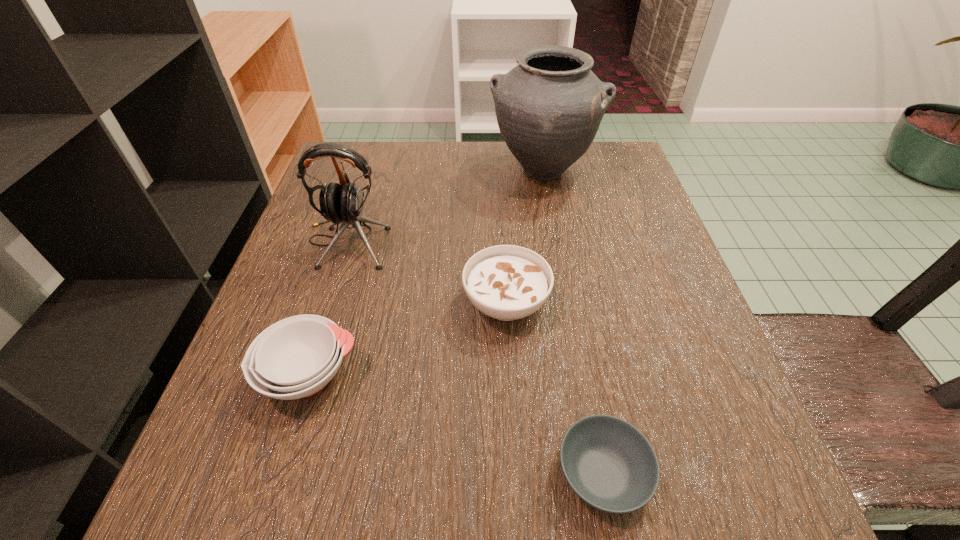
Identify the location of object situated at the far edge. The width and height of the screenshot is (960, 540). (549, 107).

You are a GUI agent. You are given a task and a screenshot of the screen. Output one action in this format:
    pyautogui.click(x=<x>, y=<y>)
    Task: Click on the object that is positioned at the near edge
    This screenshot has width=960, height=540.
    Given the screenshot: What is the action you would take?
    [609, 464]

The height and width of the screenshot is (540, 960). I want to click on earphone positioned at the left edge, so click(343, 203).

Locate an element on the screen. The width and height of the screenshot is (960, 540). soup bowl that is at the left edge is located at coordinates (296, 357).

At what (x,y) coordinates should I click in order to perform the action: click on urn at the right edge. Please return your answer as a coordinate pair (x, y). The height and width of the screenshot is (540, 960). Looking at the image, I should click on (549, 107).

Identify the location of soup bowl that is at the right edge. The image size is (960, 540). (609, 464).

Where is `object at the far right corner`? object at the far right corner is located at coordinates (549, 107).

At what (x,y) coordinates should I click in order to perform the action: click on object that is at the near right corner. Please return your answer as a coordinate pair (x, y). This screenshot has width=960, height=540. Looking at the image, I should click on (609, 464).

You are a GUI agent. You are given a task and a screenshot of the screen. Output one action in this format:
    pyautogui.click(x=<x>, y=<y>)
    Task: Click on the vacant space at the far edge of the desktop
    Image resolution: width=960 pixels, height=540 pixels.
    Given the screenshot: What is the action you would take?
    pyautogui.click(x=444, y=152)

Image resolution: width=960 pixels, height=540 pixels. I want to click on free region at the near edge of the desktop, so click(x=526, y=468).